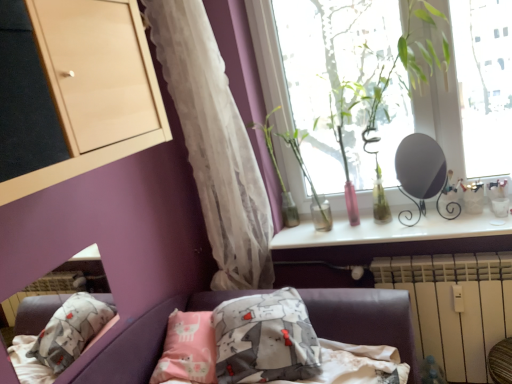
Question: Considering the positions of point (451, 218) and point (286, 132), is point (451, 218) closer or farther from the camera than point (286, 132)?

Choices:
 (A) closer
 (B) farther

Answer: (A)

Question: From the image's perspective, is matte black mirror at upper right positioned above or below green glass vase at upper center, arranged as the 2th plant when viewed from the left?

Choices:
 (A) below
 (B) above

Answer: (B)

Question: Which is nearer to the white plastic radiator at lower right?

Choices:
 (A) translucent white curtain at left
 (B) transparent glass window at upper right
 (C) green glass vase at upper center, which is the 1th plant in left-to-right order
 (D) green glass vase at upper center, arranged as the 2th plant when viewed from the left
 (E) matte black mirror at upper right

Answer: (E)

Question: Based on their relative distances, which object is farther from the matte black mirror at upper right?

Choices:
 (A) white plastic radiator at lower right
 (B) green glass vase at upper center, which is the second plant in right-to-left order
 (C) transparent glass window at upper right
 (D) green glass vase at upper center, which appears as the first plant when viewed from the right
 (E) translucent white curtain at left

Answer: (E)